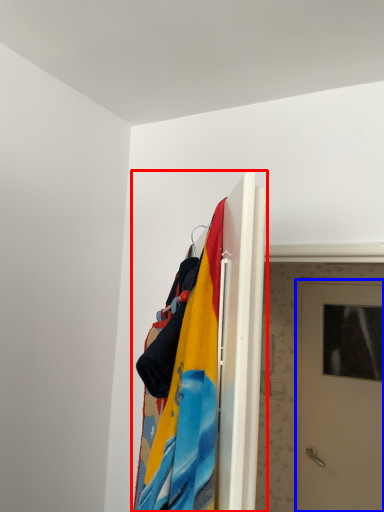
Question: Which point is closer to the camera, closet (highlighted by a red box) or door (highlighted by a blue box)?

Choices:
 (A) closet
 (B) door

Answer: (A)